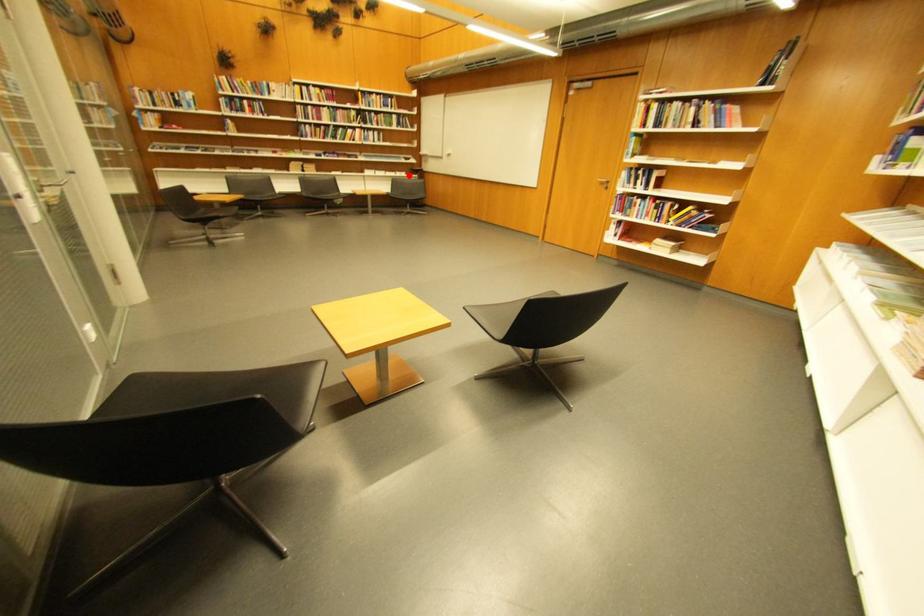
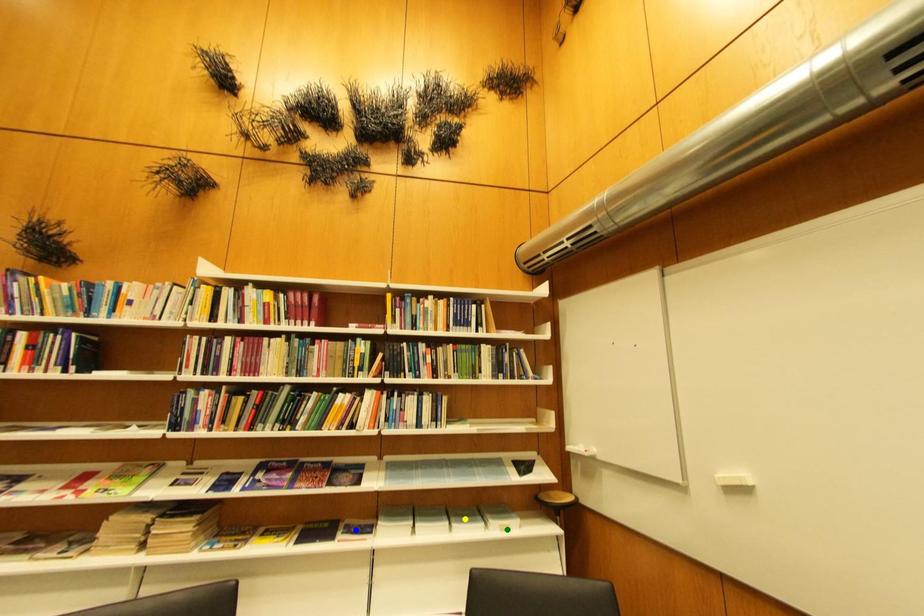
Question: I am providing you with two images of the same scene from different viewpoints. A red point is marked on the first image. You are given multiple points on the second image. Which spot in image 2 lines up with the point in image 1?

Choices:
 (A) yellow point
 (B) green point
 (C) blue point

Answer: (B)